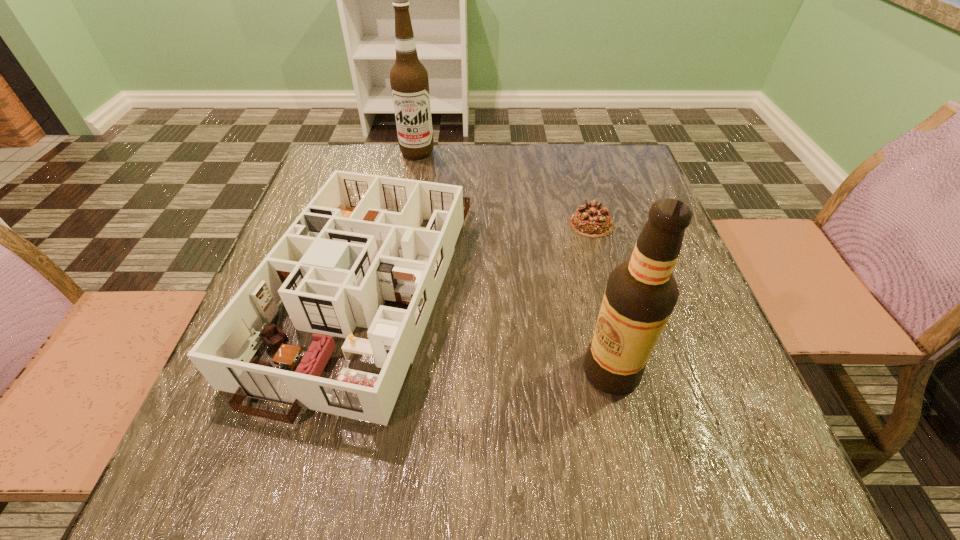
The image size is (960, 540). What are the coordinates of `free space that satisfies the following two spatial constraints: 1. on the label of the shortest object; 2. on the right side of the farthest object` in the screenshot? It's located at (404, 224).

Identify the location of free space that satisfies the following two spatial constraints: 1. on the label of the shortest object; 2. on the right side of the farther alcohol. (404, 224).